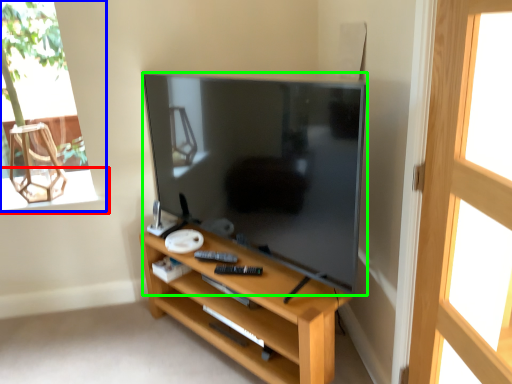
Question: Which is farther away from window sill (highlighted by a red box)? window (highlighted by a blue box) or television (highlighted by a green box)?

Choices:
 (A) window
 (B) television

Answer: (B)